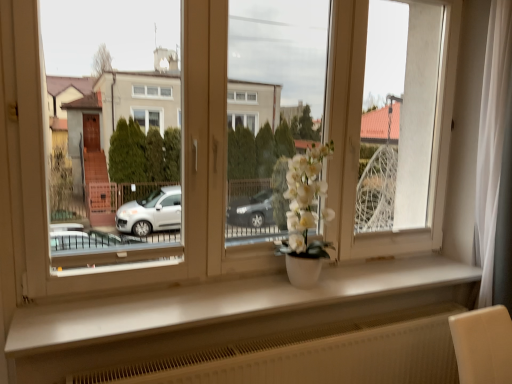
Identify the location of vacant space in between white matte vase at center and white matte flower pot at center. (264, 292).